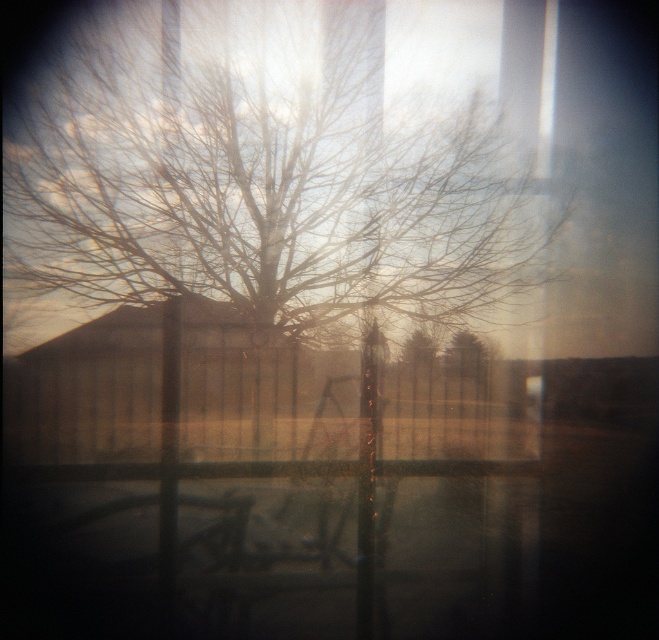
Based on the scene description, where is the green matte tree at center located in terms of coordinates?

The green matte tree at center is located at coordinates point (465,355).

You are a photographer trying to capture the scene through a slightly blurred glass. You notice the green matte tree at center and the bare branches at center. Which object appears wider in the image?

The green matte tree at center might be wider than bare branches at center according to the description.

You are standing in a garden and see the brown wooden fence at center. If you want to reach the fence, how many steps would you need to take if each step covers 0.7 meters?

The brown wooden fence at center is 3.70 meters away. Since each step covers 0.7 meters, dividing 3.70 by 0.7 gives approximately 5.28 steps. Therefore, you would need to take 6 full steps to reach the brown wooden fence at center.